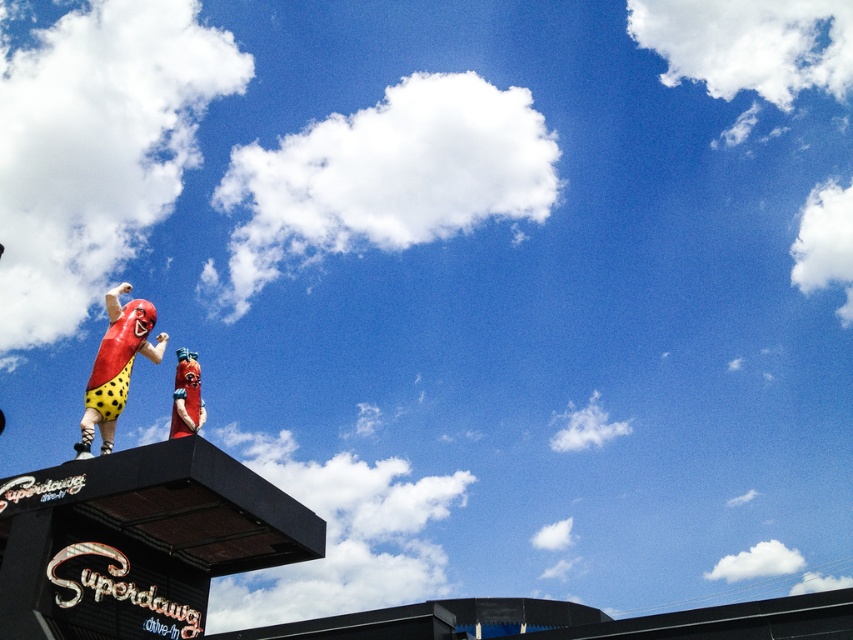
Question: Is glossy plastic hot dog at upper left to the left of matte red statue at upper center from the viewer's perspective?

Choices:
 (A) no
 (B) yes

Answer: (B)

Question: Which point appears closest to the camera in this image?

Choices:
 (A) (177, 394)
 (B) (119, 394)

Answer: (A)

Question: Can you confirm if glossy plastic hot dog at upper left is positioned below matte red statue at upper center?

Choices:
 (A) no
 (B) yes

Answer: (B)

Question: Which point is farther to the camera?

Choices:
 (A) (85, 397)
 (B) (183, 380)

Answer: (B)

Question: Which of the following is the closest to the observer?

Choices:
 (A) (113, 419)
 (B) (173, 428)

Answer: (B)

Question: Is glossy plastic hot dog at upper left positioned in front of matte red statue at upper center?

Choices:
 (A) yes
 (B) no

Answer: (A)